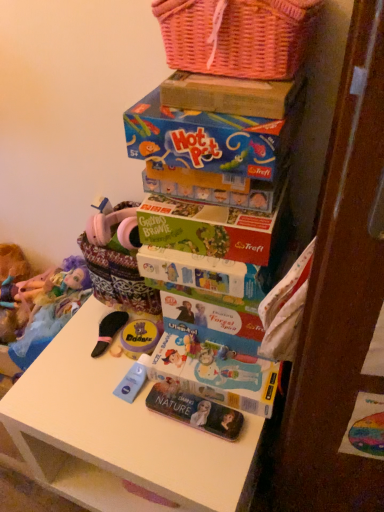
This screenshot has width=384, height=512. Identify the location of blank space situated above green matte board game at center (from a real-world perspective). (211, 204).